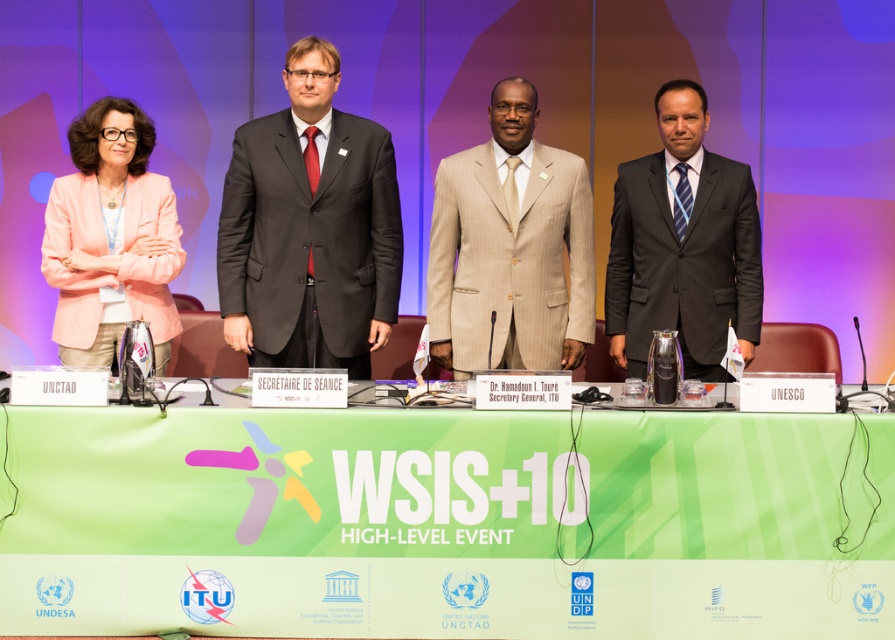
This screenshot has height=640, width=895. What do you see at coordinates (510, 248) in the screenshot? I see `beige pinstripe suit at center` at bounding box center [510, 248].

Is point (575, 323) behind point (104, 164)?

Yes, it is behind point (104, 164).

Identify the location of beige pinstripe suit at center. The width and height of the screenshot is (895, 640). (510, 248).

Identify the location of beige pinstripe suit at center. This screenshot has width=895, height=640. (510, 248).

Between point (307, 56) and point (712, 211), which one is positioned behind?

Point (712, 211)

Does matte black suit at center appear on the right side of matte black suit at right?

Incorrect, matte black suit at center is not on the right side of matte black suit at right.

What are the coordinates of `matte black suit at center` in the screenshot? It's located at (309, 228).

Which is more to the left, green fabric table at center or beige pinstripe suit at center?

Positioned to the left is green fabric table at center.

Is point (686, 456) behind point (506, 216)?

No, (686, 456) is in front of (506, 216).

The width and height of the screenshot is (895, 640). In order to click on green fabric table at center in this screenshot , I will do `click(442, 522)`.